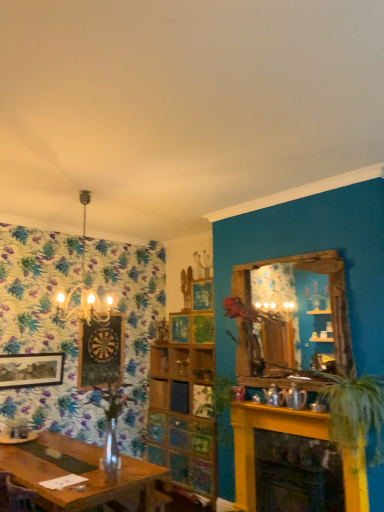
Question: Is wooden dartboard at left, which is the first picture frame in right-to-left order, positioned in front of yellow painted brick fireplace at lower right?

Choices:
 (A) yes
 (B) no

Answer: (B)

Question: From a real-world perspective, is wooden dartboard at left, which ranks as the 2th picture frame in front-to-back order, on yellow painted brick fireplace at lower right?

Choices:
 (A) no
 (B) yes

Answer: (B)

Question: Is wooden dartboard at left, which is the first picture frame in right-to-left order, oriented away from yellow painted brick fireplace at lower right?

Choices:
 (A) no
 (B) yes

Answer: (A)

Question: Is wooden dartboard at left, which ranks as the 2th picture frame in front-to-back order, to the left of yellow painted brick fireplace at lower right from the viewer's perspective?

Choices:
 (A) no
 (B) yes

Answer: (B)

Question: Is yellow painted brick fireplace at lower right located within wooden dartboard at left, which ranks as the 2th picture frame in front-to-back order?

Choices:
 (A) yes
 (B) no

Answer: (B)

Question: Does wooden dartboard at left, which ranks as the 2th picture frame in front-to-back order, turn towards yellow painted brick fireplace at lower right?

Choices:
 (A) yes
 (B) no

Answer: (A)

Question: From a real-world perspective, does green leafy plant at center, the 1th plant from the back, stand above clear glass vase at center, which is the second plant in back-to-front order?

Choices:
 (A) yes
 (B) no

Answer: (A)

Question: From a real-world perspective, is green leafy plant at center, the 1th plant from the back, below clear glass vase at center, which appears as the second plant when viewed from the front?

Choices:
 (A) no
 (B) yes

Answer: (A)

Question: Considering the relative sizes of green leafy plant at center, arranged as the 2th plant when viewed from the left, and clear glass vase at center, the 3th plant from the right, in the image provided, is green leafy plant at center, arranged as the 2th plant when viewed from the left, smaller than clear glass vase at center, the 3th plant from the right,?

Choices:
 (A) yes
 (B) no

Answer: (B)

Question: Considering the relative positions of green leafy plant at center, arranged as the 2th plant when viewed from the left, and clear glass vase at center, which appears as the second plant when viewed from the front, in the image provided, is green leafy plant at center, arranged as the 2th plant when viewed from the left, to the right of clear glass vase at center, which appears as the second plant when viewed from the front, from the viewer's perspective?

Choices:
 (A) yes
 (B) no

Answer: (A)

Question: Does green leafy plant at center, the 1th plant from the back, have a larger size compared to clear glass vase at center, which appears as the second plant when viewed from the front?

Choices:
 (A) no
 (B) yes

Answer: (B)

Question: Does green leafy plant at center, the 1th plant from the back, have a greater height compared to clear glass vase at center, which is the second plant in back-to-front order?

Choices:
 (A) yes
 (B) no

Answer: (A)

Question: Is wooden dartboard at left, which is the first picture frame in right-to-left order, shorter than green leafy plant at center, which ranks as the second plant in right-to-left order?

Choices:
 (A) yes
 (B) no

Answer: (B)